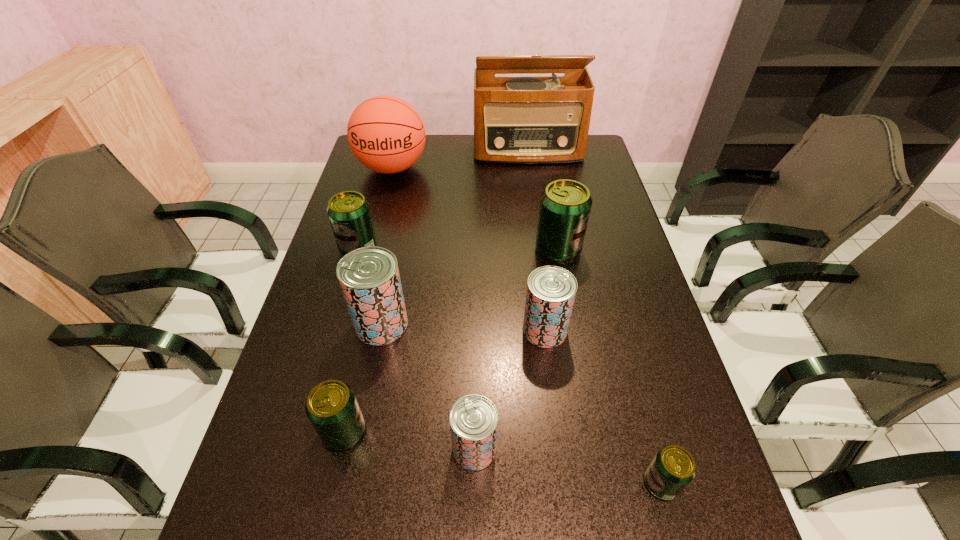
The width and height of the screenshot is (960, 540). In order to click on the rightmost green beer can in this screenshot , I will do `click(672, 469)`.

Identify the location of vacant space located on the front panel of the radio receiver. (538, 218).

Image resolution: width=960 pixels, height=540 pixels. I want to click on vacant region located on the side with logo of the eighth shortest object, so click(371, 252).

At what (x,y) coordinates should I click in order to perform the action: click on vacant space located on the front of the biggest green beer can. Please return your answer as a coordinate pair (x, y). Looking at the image, I should click on point(564,287).

You are a GUI agent. You are given a task and a screenshot of the screen. Output one action in this format:
    pyautogui.click(x=<x>, y=<y>)
    Task: Click on the free space located 0.220m on the right of the leftmost red beer can
    
    Given the screenshot: What is the action you would take?
    pyautogui.click(x=498, y=325)

The height and width of the screenshot is (540, 960). Identify the location of vacant space located on the back of the rightmost red beer can. [x=532, y=226].

Locate an element on the screen. The height and width of the screenshot is (540, 960). free space located 0.400m on the right of the third smallest green beer can is located at coordinates (517, 248).

Locate an element on the screen. This screenshot has height=540, width=960. free space located on the back of the nearest red beer can is located at coordinates (475, 372).

The height and width of the screenshot is (540, 960). Identify the location of vacant space located 0.170m on the back of the third farthest green beer can. (364, 343).

Locate an element on the screen. Image resolution: width=960 pixels, height=540 pixels. blank space located 0.390m on the left of the shortest object is located at coordinates (433, 483).